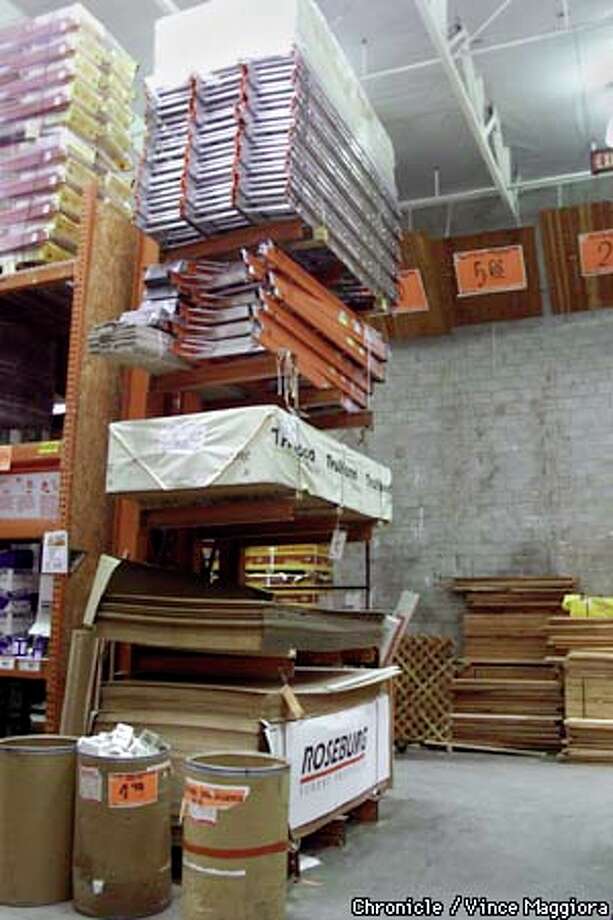
Identify the location of wall. (493, 465).